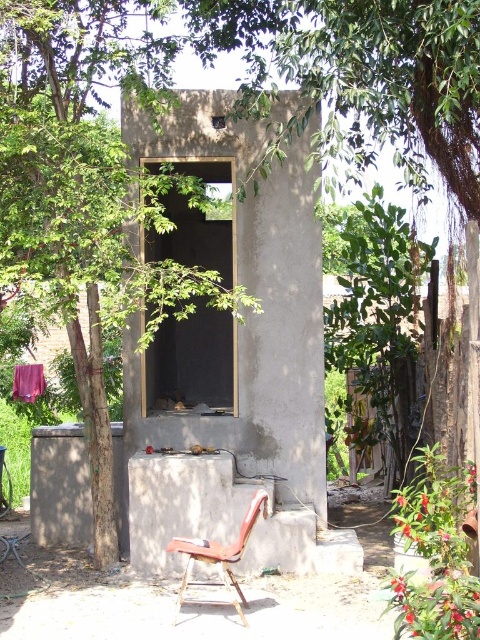
Question: Is green leafy tree at center thinner than matte brown concrete at lower center?

Choices:
 (A) yes
 (B) no

Answer: (B)

Question: Estimate the real-world distances between objects in this image. Which object is closer to the gray concrete wall at lower left?

Choices:
 (A) metallic red chair at lower center
 (B) gray concrete hut at center

Answer: (A)

Question: Can you confirm if matte brown concrete at lower center is positioned below purple fabric at center?

Choices:
 (A) no
 (B) yes

Answer: (B)

Question: Among these points, which one is nearest to the camera?

Choices:
 (A) (35, 364)
 (B) (94, 289)
 (C) (271, 216)
 (D) (166, 467)

Answer: (B)

Question: Observing the image, what is the correct spatial positioning of green leafy tree at center in reference to matte brown concrete at lower center?

Choices:
 (A) right
 (B) left

Answer: (B)

Question: Which object is farther from the camera taking this photo?

Choices:
 (A) gray concrete hut at center
 (B) matte brown concrete at lower center

Answer: (A)